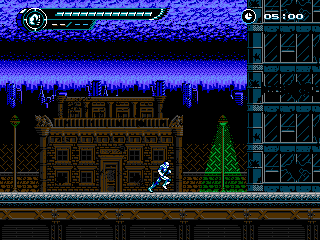
This screenshot has height=240, width=320. Identify the location of light up tree in beginning of gif. (54, 164).